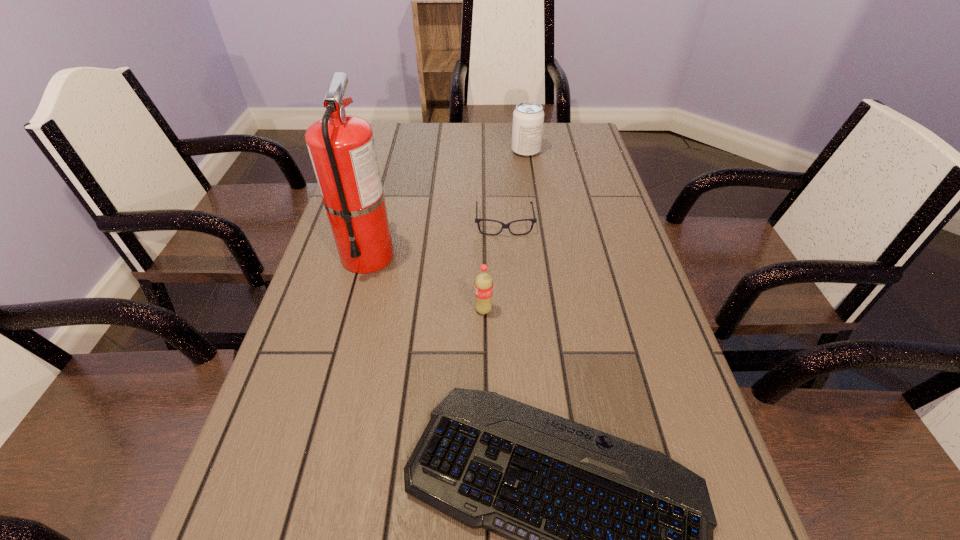
In order to click on fire extinguisher in this screenshot , I will do `click(342, 149)`.

This screenshot has height=540, width=960. Identify the location of the leftmost object. (342, 149).

Find the location of a particular element. The height and width of the screenshot is (540, 960). the right soda is located at coordinates (528, 117).

You are a GUI agent. You are given a task and a screenshot of the screen. Output one action in this format:
    pyautogui.click(x=<x>, y=<y>)
    Task: Click on the farthest object
    Image resolution: width=960 pixels, height=540 pixels.
    Given the screenshot: What is the action you would take?
    pyautogui.click(x=528, y=117)

Where is `the left soda`? This screenshot has height=540, width=960. the left soda is located at coordinates (483, 285).

Find the location of a particular element. The height and width of the screenshot is (540, 960). the fourth farthest object is located at coordinates (483, 285).

Locate an element on the screen. The height and width of the screenshot is (540, 960). the fourth tallest object is located at coordinates (477, 220).

Find the location of `blank space located at the nozzle of the tallest object`. blank space located at the nozzle of the tallest object is located at coordinates (314, 457).

Identify the location of vacant space situated on the left of the farther soda. (433, 151).

Where is `free space located 0.180m on the left of the fourth farthest object`? The width and height of the screenshot is (960, 540). free space located 0.180m on the left of the fourth farthest object is located at coordinates (390, 310).